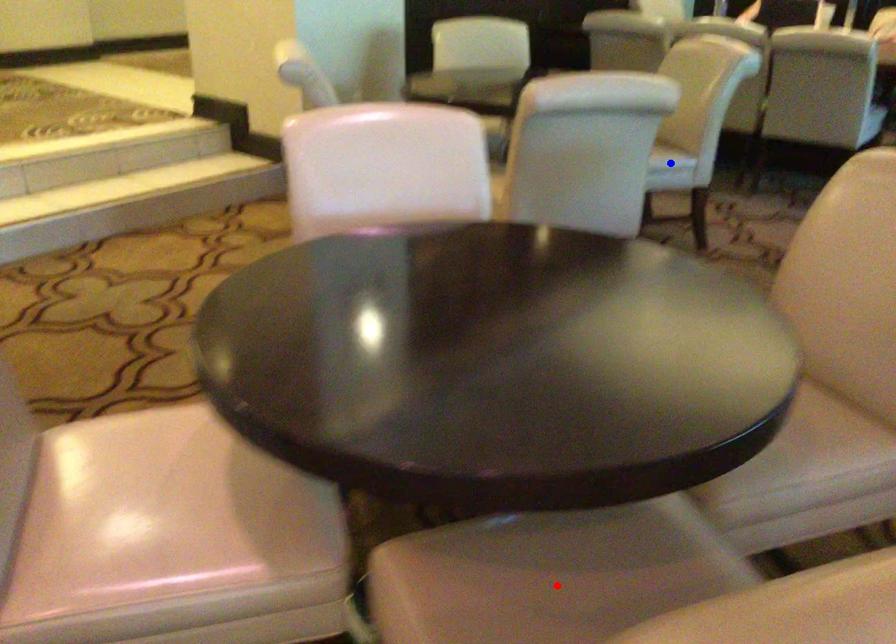
Question: Which of the two points in the image is closer to the camera?

Choices:
 (A) Blue point is closer.
 (B) Red point is closer.

Answer: (B)